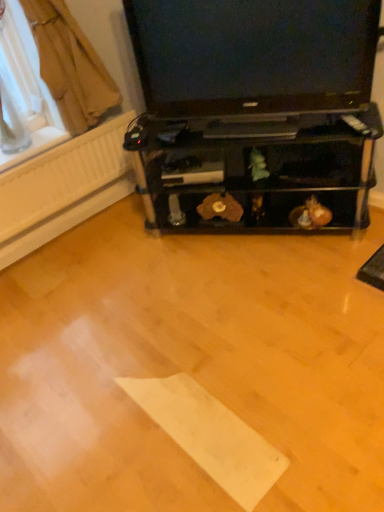
What do you see at coordinates (27, 85) in the screenshot?
I see `transparent plastic window screen at upper left` at bounding box center [27, 85].

Identify the location of transparent plastic window screen at upper left. This screenshot has width=384, height=512. (27, 85).

Locate an element on the screen. black glossy television at upper center is located at coordinates click(x=253, y=54).

Consider the image. Considering the relative positions of transparent plastic window screen at upper left and black glossy television at upper center in the image provided, is transparent plastic window screen at upper left behind black glossy television at upper center?

Yes, it is.

Is transparent plastic window screen at upper left facing away from black glossy television at upper center?

No, black glossy television at upper center is not at the back of transparent plastic window screen at upper left.

Are transparent plastic window screen at upper left and black glossy television at upper center making contact?

No, transparent plastic window screen at upper left is not beside black glossy television at upper center.

Does brown fabric curtain at upper left have a greater width compared to transparent plastic window screen at upper left?

Incorrect, the width of brown fabric curtain at upper left does not surpass that of transparent plastic window screen at upper left.

Which object is further away from the camera taking this photo, brown fabric curtain at upper left or transparent plastic window screen at upper left?

transparent plastic window screen at upper left is further from the camera.

From a real-world perspective, which object stands above the other?

transparent plastic window screen at upper left is physically above.

Is transparent plastic window screen at upper left bigger than brown fabric curtain at upper left?

Incorrect, transparent plastic window screen at upper left is not larger than brown fabric curtain at upper left.

Is the position of transparent plastic window screen at upper left more distant than that of brown fabric curtain at upper left?

Yes, the depth of transparent plastic window screen at upper left is greater than that of brown fabric curtain at upper left.

Is transparent plastic window screen at upper left surrounding brown fabric curtain at upper left?

Yes, brown fabric curtain at upper left can be found within transparent plastic window screen at upper left.

Is transparent plastic window screen at upper left wider than brown fabric curtain at upper left?

Indeed, transparent plastic window screen at upper left has a greater width compared to brown fabric curtain at upper left.

Is brown fabric curtain at upper left far away from black glossy television at upper center?

brown fabric curtain at upper left is near black glossy television at upper center, not far away.

Is brown fabric curtain at upper left inside or outside of black glossy television at upper center?

brown fabric curtain at upper left cannot be found inside black glossy television at upper center.

Does brown fabric curtain at upper left have a smaller size compared to black glossy television at upper center?

Correct, brown fabric curtain at upper left occupies less space than black glossy television at upper center.

How different are the orientations of brown fabric curtain at upper left and black glossy television at upper center in degrees?

brown fabric curtain at upper left and black glossy television at upper center are facing 58 degrees away from each other.

Considering the relative sizes of black glossy television at upper center and transparent plastic window screen at upper left in the image provided, is black glossy television at upper center shorter than transparent plastic window screen at upper left?

Correct, black glossy television at upper center is not as tall as transparent plastic window screen at upper left.

From a real-world perspective, is black glossy television at upper center positioned above or below transparent plastic window screen at upper left?

black glossy television at upper center is situated lower than transparent plastic window screen at upper left in the real world.

Which is more to the right, black glossy television at upper center or transparent plastic window screen at upper left?

From the viewer's perspective, black glossy television at upper center appears more on the right side.

Is transparent plastic window screen at upper left inside black glossy television at upper center?

Actually, transparent plastic window screen at upper left is outside black glossy television at upper center.

Is black glossy television at upper center beside brown fabric curtain at upper left?

No, black glossy television at upper center is not with brown fabric curtain at upper left.

Find the location of a particular element. curtain that is above the black glossy television at upper center (from a real-world perspective) is located at coordinates (70, 66).

From the image's perspective, relative to brown fabric curtain at upper left, is black glossy television at upper center above or below?

black glossy television at upper center is below brown fabric curtain at upper left.

Is black glossy television at upper center in front of brown fabric curtain at upper left?

Yes, the depth of black glossy television at upper center is less than that of brown fabric curtain at upper left.

Locate an element on the screen. The image size is (384, 512). television below the transparent plastic window screen at upper left (from a real-world perspective) is located at coordinates click(253, 54).

Locate an element on the screen. The image size is (384, 512). curtain on the right of transparent plastic window screen at upper left is located at coordinates (70, 66).

Consider the image. When comparing their distances from transparent plastic window screen at upper left, does black glossy television at upper center or brown fabric curtain at upper left seem closer?

brown fabric curtain at upper left is closer to transparent plastic window screen at upper left.

Looking at the image, which one is located further to brown fabric curtain at upper left, black glossy television at upper center or transparent plastic window screen at upper left?

black glossy television at upper center lies further to brown fabric curtain at upper left than the other object.

Considering their positions, is brown fabric curtain at upper left positioned further to transparent plastic window screen at upper left than black glossy television at upper center?

Among the two, black glossy television at upper center is located further to transparent plastic window screen at upper left.

Looking at the image, which one is located further to black glossy television at upper center, brown fabric curtain at upper left or transparent plastic window screen at upper left?

Based on the image, transparent plastic window screen at upper left appears to be further to black glossy television at upper center.

Considering their positions, is transparent plastic window screen at upper left positioned closer to brown fabric curtain at upper left than black glossy television at upper center?

Based on the image, transparent plastic window screen at upper left appears to be nearer to brown fabric curtain at upper left.

Estimate the real-world distances between objects in this image. Which object is further from black glossy television at upper center, transparent plastic window screen at upper left or brown fabric curtain at upper left?

transparent plastic window screen at upper left lies further to black glossy television at upper center than the other object.

You are a GUI agent. You are given a task and a screenshot of the screen. Output one action in this format:
    pyautogui.click(x=<x>, y=<y>)
    Task: Click on the curtain between transparent plastic window screen at upper left and black glossy television at upper center from left to right
    The width and height of the screenshot is (384, 512).
    Given the screenshot: What is the action you would take?
    pyautogui.click(x=70, y=66)